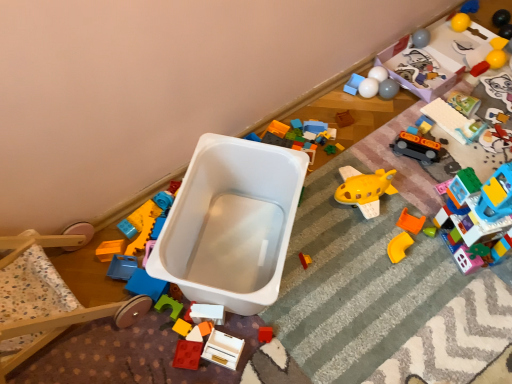
Image resolution: width=512 pixels, height=384 pixels. Identify the location of free space between orange plastic train at center, which ranks as the sixth toy in right-to-left order, and orange plastic block at lower right, placed as the 10th toy when sorted from left to right. (411, 187).